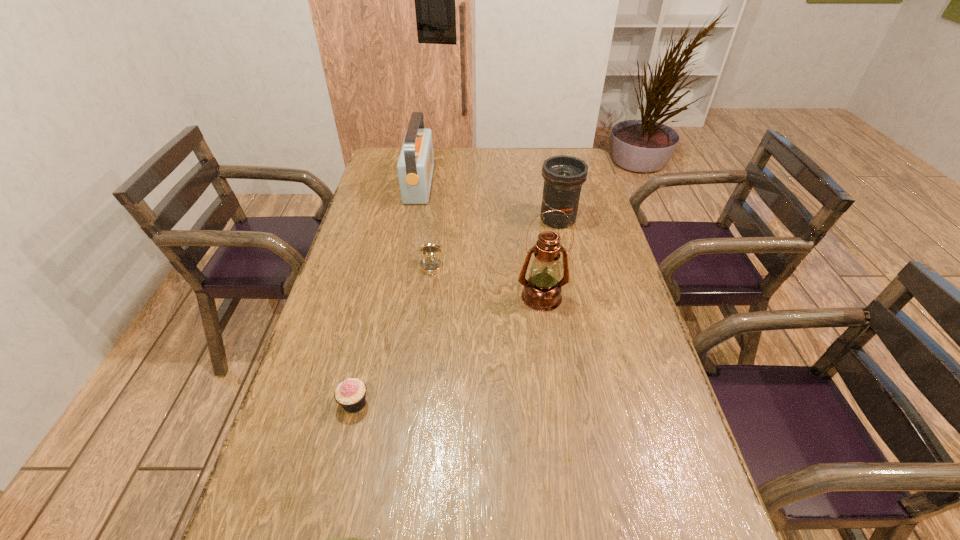
The height and width of the screenshot is (540, 960). Identify the location of the fourth farthest object. (542, 290).

The image size is (960, 540). I want to click on oil lamp, so click(x=542, y=290).

Where is `the farthest object`? the farthest object is located at coordinates (415, 165).

Where is `the fourth shortest object`? the fourth shortest object is located at coordinates 563,175.

Identify the location of telephoto lens. (563, 175).

Where is `the second nearest object`? The width and height of the screenshot is (960, 540). the second nearest object is located at coordinates (350, 394).

Identify the location of the third farthest object. Image resolution: width=960 pixels, height=540 pixels. (430, 265).

The height and width of the screenshot is (540, 960). In order to click on vacant space located 0.100m on the front of the oil lamp in this screenshot , I will do click(548, 340).

Where is `vacant area situated 0.190m on the front-facing side of the farthest object`? This screenshot has width=960, height=540. vacant area situated 0.190m on the front-facing side of the farthest object is located at coordinates (481, 184).

Identify the location of free region located on the back of the telephoto lens. The width and height of the screenshot is (960, 540). (550, 181).